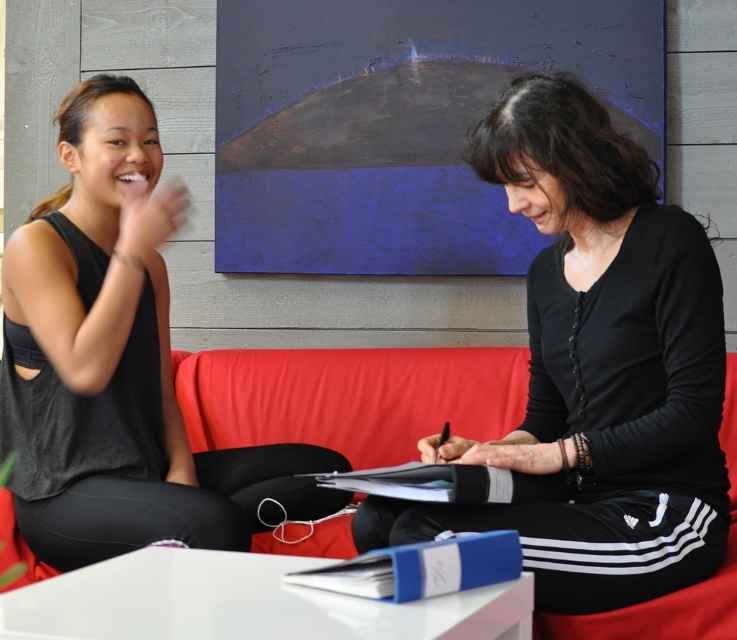
Is black matte/black jersey at center thinner than red fabric couch at center?

Indeed, black matte/black jersey at center has a lesser width compared to red fabric couch at center.

Is point (702, 326) positioned in front of point (719, 580)?

Yes, point (702, 326) is in front of point (719, 580).

Between point (621, 273) and point (380, 381), which one is positioned in front?

Positioned in front is point (621, 273).

You are a GUI agent. You are given a task and a screenshot of the screen. Output one action in this format:
    pyautogui.click(x=<x>, y=<y>)
    Task: Click on the black matte/black jersey at center
    This screenshot has height=640, width=737.
    Given the screenshot: What is the action you would take?
    pyautogui.click(x=597, y=365)

Is black matte tank top at left below red fabric couch at center?

No, black matte tank top at left is not below red fabric couch at center.

Does black matte tank top at left lie in front of red fabric couch at center?

Yes.

Is point (136, 410) positioned before point (733, 497)?

Yes, it is in front of point (733, 497).

Where is `black matte tank top at left`? The height and width of the screenshot is (640, 737). black matte tank top at left is located at coordinates (118, 364).

Does black matte/black jersey at center have a greater width compared to black matte tank top at left?

Yes.

Can you confirm if black matte/black jersey at center is positioned to the left of black matte tank top at left?

In fact, black matte/black jersey at center is to the right of black matte tank top at left.

Identify the location of black matte/black jersey at center. (597, 365).